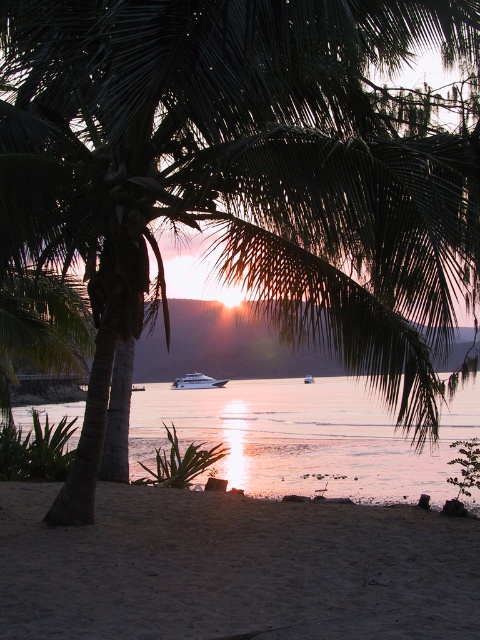
Question: Can you confirm if sandy at lower center is thinner than glistening silver water at center?

Choices:
 (A) no
 (B) yes

Answer: (B)

Question: Among these objects, which one is nearest to the camera?

Choices:
 (A) glistening silver water at center
 (B) white glossy yacht at center

Answer: (A)

Question: Does glistening silver water at center have a greater width compared to white glossy yacht at center?

Choices:
 (A) yes
 (B) no

Answer: (A)

Question: Which object is farther from the camera taking this photo?

Choices:
 (A) sandy at lower center
 (B) white glossy yacht at center
 (C) glistening silver water at center

Answer: (B)

Question: Is glistening silver water at center to the right of white glossy yacht at center from the viewer's perspective?

Choices:
 (A) yes
 (B) no

Answer: (A)

Question: Based on their relative distances, which object is nearer to the sandy at lower center?

Choices:
 (A) white glossy yacht at center
 (B) glistening silver water at center

Answer: (B)